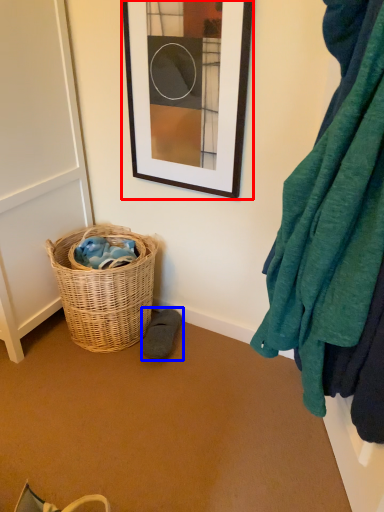
Question: Which object is further to the camera taking this photo, picture frame (highlighted by a red box) or shoe (highlighted by a blue box)?

Choices:
 (A) picture frame
 (B) shoe

Answer: (B)